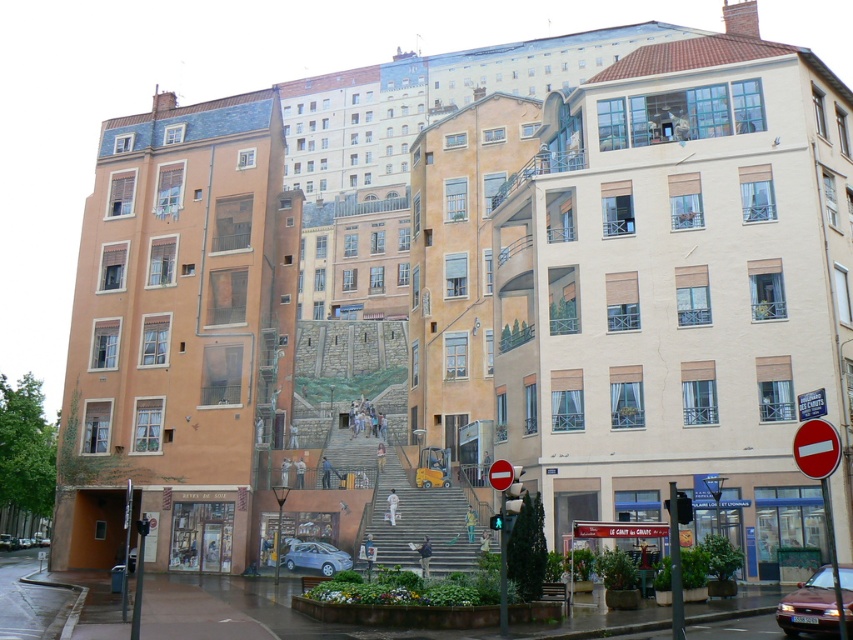
You are a pedestrian standing at the street corner and want to reach the yellow plastic stairs at center. There is a red plastic sign at center in your path. Which object will you encounter first?

You will encounter the yellow plastic stairs at center first because it is closer to you than the red plastic sign at center.

You are standing at the point with coordinates point (821, 401) and want to look towards the point with coordinates point (447, 566). Can you see it directly without any obstruction?

Since point (447, 566) is behind point (821, 401), you cannot see it directly as it is obstructed by the latter point.

You are a delivery person trying to park your silver metallic hatchback at center near the red plastic sign at right. Given that your car is 15 feet long, is there enough space between them to park comfortably?

The distance between the red plastic sign at right and the silver metallic hatchback at center is 128.22 feet, which is more than enough space for the 15 feet long car to park comfortably.